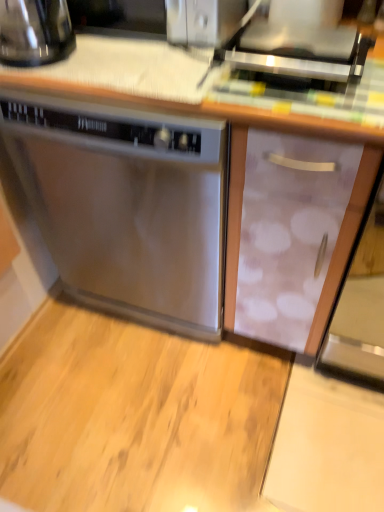
At what (x,y) coordinates should I click in order to perform the action: click on free space to the right of shiny black kettle at upper left. Please return your answer as a coordinate pair (x, y). This screenshot has height=512, width=384. Looking at the image, I should click on (113, 61).